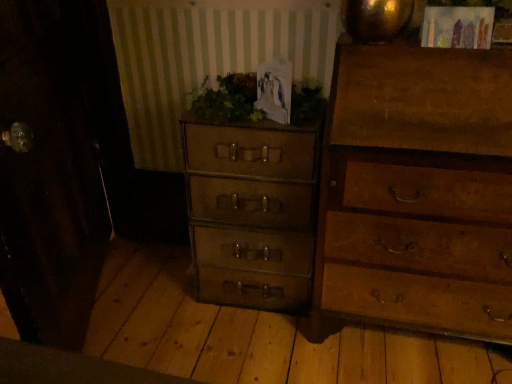
In order to face matte brown suitcase at center, which is the 1th chest of drawers from left to right, should I rotate leftwards or rightwards?

It's best to rotate left around 0.442 degrees.

Describe the element at coordinates (251, 212) in the screenshot. I see `matte brown suitcase at center, which is the 1th chest of drawers from left to right` at that location.

Describe the element at coordinates (227, 99) in the screenshot. This screenshot has height=384, width=512. I see `green leafy plant at center` at that location.

At what (x,y) coordinates should I click in order to perform the action: click on matte brown suitcase at center, the 2th chest of drawers from the right. Please return your answer as a coordinate pair (x, y). The height and width of the screenshot is (384, 512). Looking at the image, I should click on (251, 212).

Is matte brown suitcase at center, the 2th chest of drawers from the right, in front of or behind green leafy plant at center in the image?

matte brown suitcase at center, the 2th chest of drawers from the right, is positioned farther from the viewer than green leafy plant at center.

Is matte brown suitcase at center, which is the 1th chest of drawers from left to right, oriented away from green leafy plant at center?

matte brown suitcase at center, which is the 1th chest of drawers from left to right, does not have its back to green leafy plant at center.

Based on the photo, is matte brown suitcase at center, which is the 1th chest of drawers from left to right, located outside green leafy plant at center?

Indeed, matte brown suitcase at center, which is the 1th chest of drawers from left to right, is completely outside green leafy plant at center.

Looking at their sizes, would you say matte brown suitcase at center, the 2th chest of drawers from the right, is wider or thinner than green leafy plant at center?

Clearly, matte brown suitcase at center, the 2th chest of drawers from the right, has more width compared to green leafy plant at center.

Is point (318, 130) less distant than point (415, 221)?

No, (318, 130) is further to viewer.

Is wooden chest of drawers at right, acting as the 1th chest of drawers starting from the right, located within matte brown suitcase at center, the 2th chest of drawers from the right?

That's incorrect, wooden chest of drawers at right, acting as the 1th chest of drawers starting from the right, is not inside matte brown suitcase at center, the 2th chest of drawers from the right.

Where is `chest of drawers above the matte brown suitcase at center, which is the 1th chest of drawers from left to right (from a real-world perspective)`? chest of drawers above the matte brown suitcase at center, which is the 1th chest of drawers from left to right (from a real-world perspective) is located at coordinates (417, 193).

Who is taller, matte brown suitcase at center, the 2th chest of drawers from the right, or wooden chest of drawers at right, acting as the 1th chest of drawers starting from the right?

wooden chest of drawers at right, acting as the 1th chest of drawers starting from the right.

Is wooden chest of drawers at right, marked as the 2th chest of drawers in a left-to-right arrangement, inside green leafy plant at center?

That's incorrect, wooden chest of drawers at right, marked as the 2th chest of drawers in a left-to-right arrangement, is not inside green leafy plant at center.

Could you tell me if green leafy plant at center is facing wooden chest of drawers at right, acting as the 1th chest of drawers starting from the right?

No, green leafy plant at center does not turn towards wooden chest of drawers at right, acting as the 1th chest of drawers starting from the right.

Considering the relative sizes of green leafy plant at center and wooden chest of drawers at right, marked as the 2th chest of drawers in a left-to-right arrangement, in the image provided, is green leafy plant at center bigger than wooden chest of drawers at right, marked as the 2th chest of drawers in a left-to-right arrangement,?

Actually, green leafy plant at center might be smaller than wooden chest of drawers at right, marked as the 2th chest of drawers in a left-to-right arrangement.

How many degrees apart are the facing directions of green leafy plant at center and wooden chest of drawers at right, marked as the 2th chest of drawers in a left-to-right arrangement?

There is a 4.67-degree angle between the facing directions of green leafy plant at center and wooden chest of drawers at right, marked as the 2th chest of drawers in a left-to-right arrangement.

From a real-world perspective, relative to matte brown suitcase at center, the 2th chest of drawers from the right, is wooden chest of drawers at right, marked as the 2th chest of drawers in a left-to-right arrangement, vertically above or below?

Clearly, from a real-world perspective, wooden chest of drawers at right, marked as the 2th chest of drawers in a left-to-right arrangement, is above matte brown suitcase at center, the 2th chest of drawers from the right.

Does point (456, 148) appear closer or farther from the camera than point (204, 127)?

Point (456, 148) is positioned closer to the camera compared to point (204, 127).

Would you say wooden chest of drawers at right, acting as the 1th chest of drawers starting from the right, contains matte brown suitcase at center, which is the 1th chest of drawers from left to right?

No, matte brown suitcase at center, which is the 1th chest of drawers from left to right, is not inside wooden chest of drawers at right, acting as the 1th chest of drawers starting from the right.

Is there a large distance between wooden chest of drawers at right, marked as the 2th chest of drawers in a left-to-right arrangement, and matte brown suitcase at center, which is the 1th chest of drawers from left to right?

Actually, wooden chest of drawers at right, marked as the 2th chest of drawers in a left-to-right arrangement, and matte brown suitcase at center, which is the 1th chest of drawers from left to right, are a little close together.

Where is `the chest of drawers that is the 1st object located below the green leafy plant at center (from the image's perspective)`? This screenshot has width=512, height=384. the chest of drawers that is the 1st object located below the green leafy plant at center (from the image's perspective) is located at coordinates (417, 193).

Is wooden chest of drawers at right, marked as the 2th chest of drawers in a left-to-right arrangement, in contact with green leafy plant at center?

No, wooden chest of drawers at right, marked as the 2th chest of drawers in a left-to-right arrangement, is not touching green leafy plant at center.

From the image's perspective, is wooden chest of drawers at right, marked as the 2th chest of drawers in a left-to-right arrangement, on top of green leafy plant at center?

Incorrect, from the image's perspective, wooden chest of drawers at right, marked as the 2th chest of drawers in a left-to-right arrangement, is lower than green leafy plant at center.

Which of these two, wooden chest of drawers at right, acting as the 1th chest of drawers starting from the right, or green leafy plant at center, stands taller?

Result: With more height is wooden chest of drawers at right, acting as the 1th chest of drawers starting from the right.

From the image's perspective, would you say green leafy plant at center is positioned over matte brown suitcase at center, the 2th chest of drawers from the right?

Yes, from the image's perspective, green leafy plant at center is on top of matte brown suitcase at center, the 2th chest of drawers from the right.

Is point (226, 94) positioned in front of point (194, 231)?

Yes, point (226, 94) is closer to viewer.

Is matte brown suitcase at center, which is the 1th chest of drawers from left to right, a part of green leafy plant at center?

No, green leafy plant at center does not contain matte brown suitcase at center, which is the 1th chest of drawers from left to right.

In terms of height, does green leafy plant at center look taller or shorter compared to matte brown suitcase at center, the 2th chest of drawers from the right?

Considering their sizes, green leafy plant at center has less height than matte brown suitcase at center, the 2th chest of drawers from the right.

Where is `houseplant that appears above the matte brown suitcase at center, the 2th chest of drawers from the right (from the image's perspective)`? houseplant that appears above the matte brown suitcase at center, the 2th chest of drawers from the right (from the image's perspective) is located at coordinates point(227,99).

The width and height of the screenshot is (512, 384). In order to click on chest of drawers behind the wooden chest of drawers at right, marked as the 2th chest of drawers in a left-to-right arrangement in this screenshot , I will do `click(251, 212)`.

When comparing their distances from matte brown suitcase at center, the 2th chest of drawers from the right, does green leafy plant at center or wooden chest of drawers at right, acting as the 1th chest of drawers starting from the right, seem further?

wooden chest of drawers at right, acting as the 1th chest of drawers starting from the right, is further to matte brown suitcase at center, the 2th chest of drawers from the right.

Estimate the real-world distances between objects in this image. Which object is closer to green leafy plant at center, matte brown suitcase at center, the 2th chest of drawers from the right, or wooden chest of drawers at right, marked as the 2th chest of drawers in a left-to-right arrangement?

Based on the image, matte brown suitcase at center, the 2th chest of drawers from the right, appears to be nearer to green leafy plant at center.

When comparing their distances from green leafy plant at center, does wooden chest of drawers at right, acting as the 1th chest of drawers starting from the right, or matte brown suitcase at center, the 2th chest of drawers from the right, seem further?

Based on the image, wooden chest of drawers at right, acting as the 1th chest of drawers starting from the right, appears to be further to green leafy plant at center.

Considering their positions, is green leafy plant at center positioned further to wooden chest of drawers at right, acting as the 1th chest of drawers starting from the right, than matte brown suitcase at center, the 2th chest of drawers from the right?

The object further to wooden chest of drawers at right, acting as the 1th chest of drawers starting from the right, is green leafy plant at center.

From the image, which object appears to be nearer to wooden chest of drawers at right, marked as the 2th chest of drawers in a left-to-right arrangement, matte brown suitcase at center, which is the 1th chest of drawers from left to right, or green leafy plant at center?

Among the two, matte brown suitcase at center, which is the 1th chest of drawers from left to right, is located nearer to wooden chest of drawers at right, marked as the 2th chest of drawers in a left-to-right arrangement.

From the image, which object appears to be nearer to matte brown suitcase at center, which is the 1th chest of drawers from left to right, wooden chest of drawers at right, marked as the 2th chest of drawers in a left-to-right arrangement, or green leafy plant at center?

green leafy plant at center lies closer to matte brown suitcase at center, which is the 1th chest of drawers from left to right, than the other object.

This screenshot has width=512, height=384. In order to click on chest of drawers between green leafy plant at center and wooden chest of drawers at right, acting as the 1th chest of drawers starting from the right, from left to right in this screenshot , I will do `click(251, 212)`.